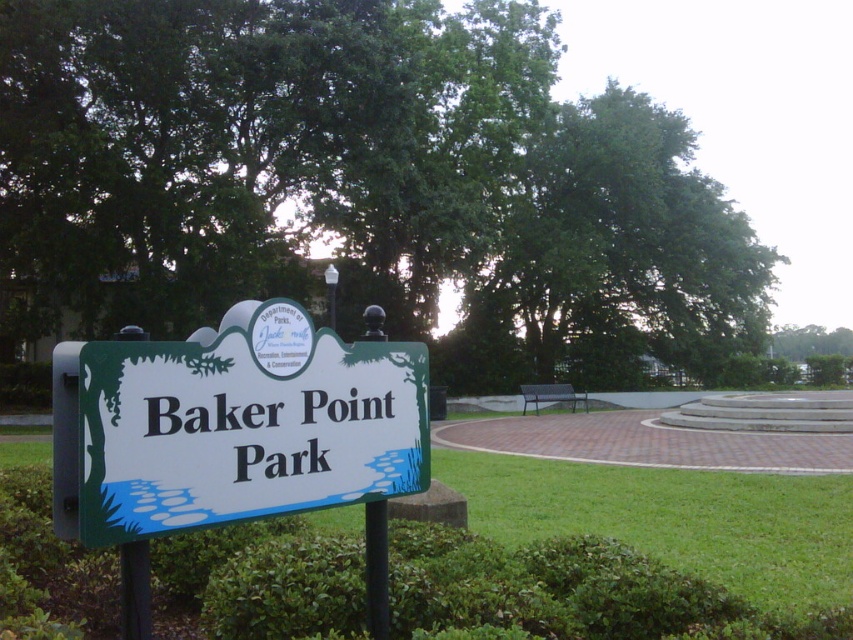
You are standing at the park entrance and notice the green leafy tree at center. Based on its position coordinates, can you determine if it is centrally aligned with the park sign?

The green leafy tree at center is located at point (363, 186), which suggests it is positioned near the center of the scene, likely aligned with the park sign.

You are a park visitor who wants to take a photo of both the green leafy tree at center and the green plastic sign at center in the same frame. Given that your camera has a maximum focal length that allows capturing objects up to 25 meters apart in the same shot, will you be able to include both in a single photo?

The green leafy tree at center and green plastic sign at center are 26.93 meters apart from each other. Since the camera can only capture objects up to 25 meters apart, you cannot include both in a single photo.

You are a visitor at Baker Point Park and want to read the green plastic sign at center. However, there is a green leafy tree at center blocking your view. Can you see the sign clearly?

The green plastic sign at center is behind the green leafy tree at center, so the tree is blocking your view of the sign.